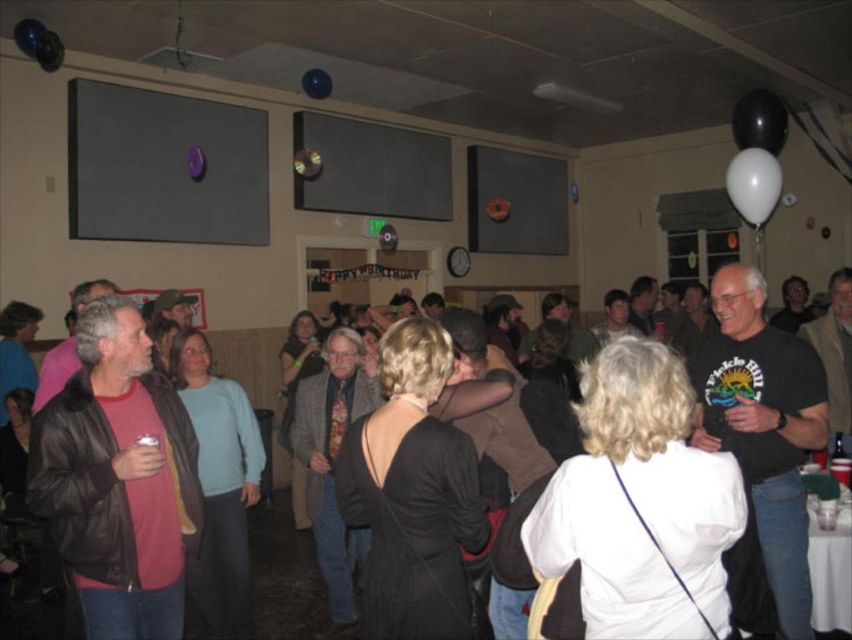
Which is more to the right, matte purple balloon at upper left or shiny blue balloon at upper center?

From the viewer's perspective, shiny blue balloon at upper center appears more on the right side.

Is matte purple balloon at upper left to the left of shiny blue balloon at upper center from the viewer's perspective?

Yes, matte purple balloon at upper left is to the left of shiny blue balloon at upper center.

The image size is (852, 640). I want to click on matte purple balloon at upper left, so click(x=49, y=51).

Does shiny blue balloon at upper left have a greater width compared to purple matte balloon at upper center?

Correct, the width of shiny blue balloon at upper left exceeds that of purple matte balloon at upper center.

Which is more to the left, shiny blue balloon at upper left or purple matte balloon at upper center?

shiny blue balloon at upper left

Measure the distance between shiny blue balloon at upper left and camera.

shiny blue balloon at upper left is 4.43 meters from camera.

The width and height of the screenshot is (852, 640). Identify the location of shiny blue balloon at upper left. (30, 36).

Does leather jacket at left have a larger size compared to black rubber balloon at upper right?

Correct, leather jacket at left is larger in size than black rubber balloon at upper right.

Who is more distant from viewer, (88, 308) or (783, 113)?

The point (783, 113) is more distant.

Who is more distant from viewer, (89,572) or (781,104)?

Positioned behind is point (781,104).

The height and width of the screenshot is (640, 852). What are the coordinates of `leather jacket at left` in the screenshot? It's located at (118, 480).